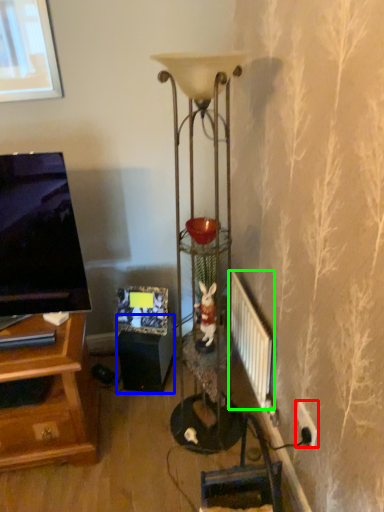
Question: Which object is positioned farthest from electric outlet (highlighted by a red box)? Select from speaker (highlighted by a blue box) and radiator (highlighted by a green box).

Choices:
 (A) speaker
 (B) radiator

Answer: (A)